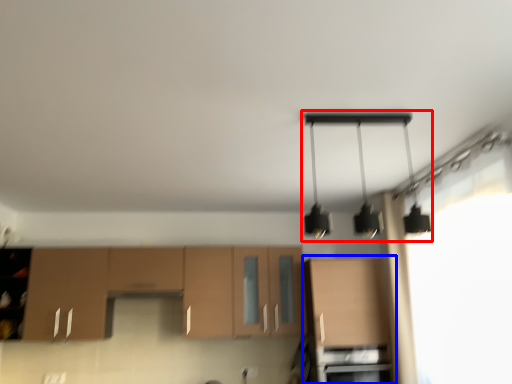
Question: Which of the following is the farthest to the observer, lamp (highlighted by a red box) or cabinetry (highlighted by a blue box)?

Choices:
 (A) lamp
 (B) cabinetry

Answer: (B)